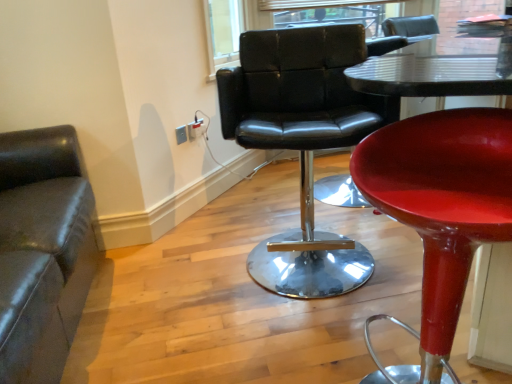
Question: Is point (31, 367) closer or farther from the camera than point (437, 299)?

Choices:
 (A) farther
 (B) closer

Answer: (A)

Question: Considering the positions of matte black leather chair at left, which is the 3th chair from right to left, and shiny red stool at center, the 1th chair in the right-to-left sequence, in the image, is matte black leather chair at left, which is the 3th chair from right to left, wider or thinner than shiny red stool at center, the 1th chair in the right-to-left sequence,?

Choices:
 (A) wide
 (B) thin

Answer: (A)

Question: Which object is positioned closest to the shiny red stool at center, the third chair when ordered from left to right?

Choices:
 (A) white plastic electrical outlet at upper center, which appears as the first electric outlet when viewed from the back
 (B) matte white electrical outlet at upper center, which is the first electric outlet from front to back
 (C) matte black leather chair at left, which is the 3th chair from right to left
 (D) black leather chair at center, the 2th chair viewed from the left
 (E) clear glass window at upper center

Answer: (D)

Question: Estimate the real-world distances between objects in this image. Which object is farther from the white plastic electrical outlet at upper center, the 2th electric outlet from the front?

Choices:
 (A) black leather chair at center, placed as the second chair when sorted from right to left
 (B) matte white electrical outlet at upper center, the 2th electric outlet viewed from the back
 (C) matte black leather chair at left, the 1th chair from the left
 (D) shiny red stool at center, the third chair when ordered from left to right
 (E) clear glass window at upper center

Answer: (D)